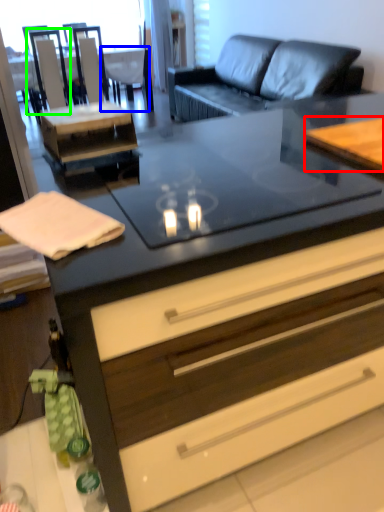
Question: Estimate the real-world distances between objects in this image. Which object is closer to table (highlighted by a red box), armchair (highlighted by a blue box) or armchair (highlighted by a green box)?

Choices:
 (A) armchair
 (B) armchair

Answer: (B)